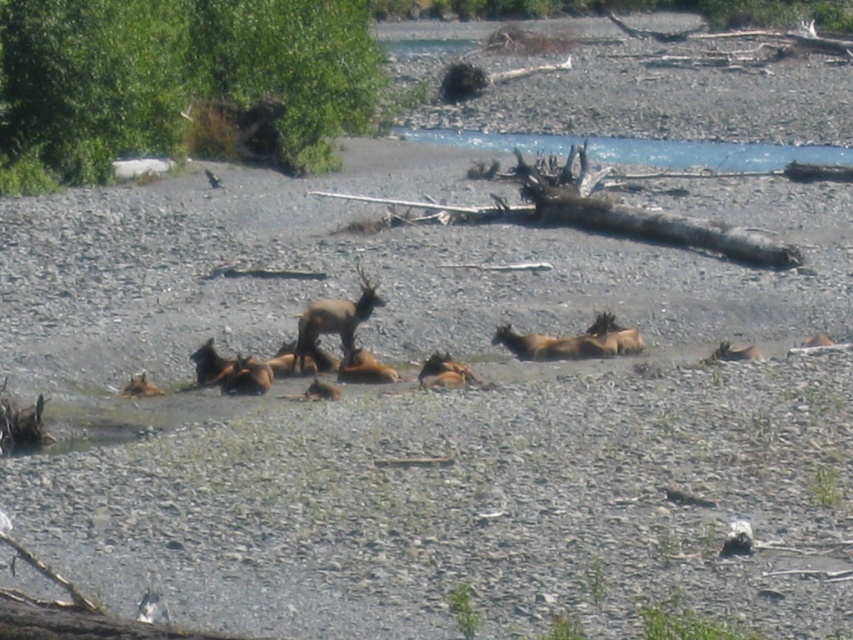
Question: Which is farther from the green leafy bush at upper left?

Choices:
 (A) brown furry deer at center
 (B) clear blue water at upper center

Answer: (A)

Question: Does green leafy bush at upper left have a smaller size compared to clear blue water at upper center?

Choices:
 (A) no
 (B) yes

Answer: (A)

Question: Estimate the real-world distances between objects in this image. Which object is farther from the green leafy bush at upper left?

Choices:
 (A) brown furry deer at center
 (B) brown fur at center
 (C) clear blue water at upper center

Answer: (B)

Question: Can you confirm if green leafy bush at upper left is wider than brown furry deer at center?

Choices:
 (A) no
 (B) yes

Answer: (B)

Question: Observing the image, what is the correct spatial positioning of green leafy bush at upper left in reference to brown furry deer at center?

Choices:
 (A) right
 (B) left

Answer: (B)

Question: Based on their relative distances, which object is nearer to the green leafy bush at upper left?

Choices:
 (A) brown furry deer at center
 (B) brown fur at center

Answer: (A)